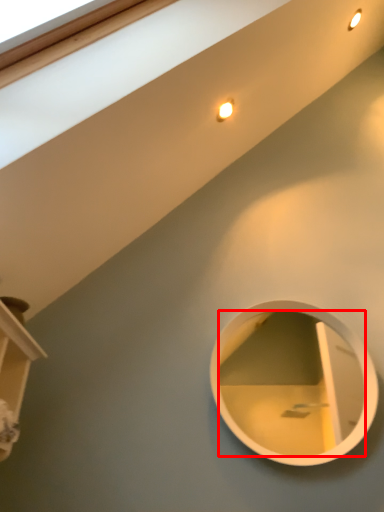
Question: From the image's perspective, where is mirror (annotated by the red box) located in relation to shelf in the image?

Choices:
 (A) above
 (B) below

Answer: (B)